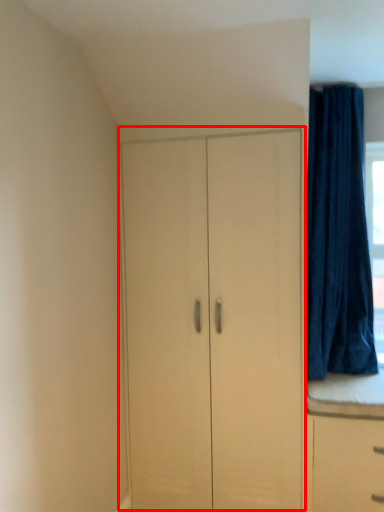
Question: From the image's perspective, where is cupboard (annotated by the red box) located in relation to curtain in the image?

Choices:
 (A) below
 (B) above

Answer: (A)